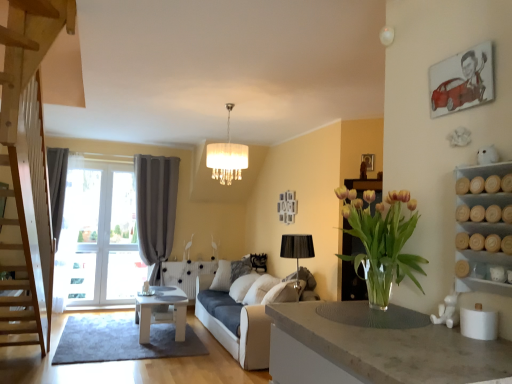
Question: Can you confirm if gray fabric curtain at left is taller than white textured pillow at center?

Choices:
 (A) no
 (B) yes

Answer: (B)

Question: Does gray fabric curtain at left have a larger size compared to white textured pillow at center?

Choices:
 (A) no
 (B) yes

Answer: (B)

Question: Is gray fabric curtain at left aimed at white textured pillow at center?

Choices:
 (A) no
 (B) yes

Answer: (A)

Question: Can you confirm if gray fabric curtain at left is shorter than white textured pillow at center?

Choices:
 (A) yes
 (B) no

Answer: (B)

Question: From a real-world perspective, is gray fabric curtain at left located beneath white textured pillow at center?

Choices:
 (A) no
 (B) yes

Answer: (A)

Question: From the image's perspective, relative to white fabric couch at center, is white wood table at center above or below?

Choices:
 (A) above
 (B) below

Answer: (B)

Question: Is point (145, 322) closer or farther from the camera than point (286, 289)?

Choices:
 (A) closer
 (B) farther

Answer: (B)

Question: Is white wood table at center spatially inside white fabric couch at center, or outside of it?

Choices:
 (A) outside
 (B) inside

Answer: (A)

Question: From a real-world perspective, relative to white fabric couch at center, is white wood table at center vertically above or below?

Choices:
 (A) above
 (B) below

Answer: (B)

Question: From the image's perspective, is wooden cylindrical containers at right positioned above or below translucent glass vase at center?

Choices:
 (A) above
 (B) below

Answer: (A)

Question: From a real-world perspective, is wooden cylindrical containers at right above or below translucent glass vase at center?

Choices:
 (A) above
 (B) below

Answer: (A)

Question: Choose the correct answer: Is wooden cylindrical containers at right inside translucent glass vase at center or outside it?

Choices:
 (A) outside
 (B) inside

Answer: (A)

Question: Is wooden cylindrical containers at right to the left or to the right of translucent glass vase at center in the image?

Choices:
 (A) right
 (B) left

Answer: (A)

Question: Is point (148, 240) closer or farther from the camera than point (382, 286)?

Choices:
 (A) closer
 (B) farther

Answer: (B)

Question: From the image's perspective, is gray fabric curtain at left above or below translucent glass vase at center?

Choices:
 (A) below
 (B) above

Answer: (A)